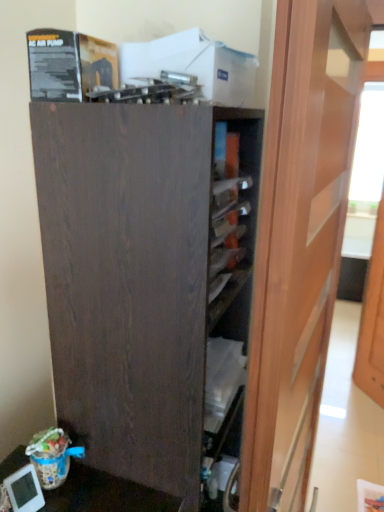
Question: Is matte wood door at center, arranged as the second door when viewed from the back, taller or shorter than dark wood cupboard at center?

Choices:
 (A) short
 (B) tall

Answer: (B)

Question: Looking at the image, does matte wood door at center, the first door viewed from the front, seem bigger or smaller compared to dark wood cupboard at center?

Choices:
 (A) small
 (B) big

Answer: (A)

Question: Which object is the closest to the wooden door at right, marked as the 1th door in a back-to-front arrangement?

Choices:
 (A) matte wood door at center, the 2th door positioned from the right
 (B) dark wood cupboard at center

Answer: (A)

Question: Estimate the real-world distances between objects in this image. Which object is closer to the wooden door at right, which is counted as the 1th door, starting from the right?

Choices:
 (A) matte wood door at center, arranged as the second door when viewed from the back
 (B) dark wood cupboard at center

Answer: (A)